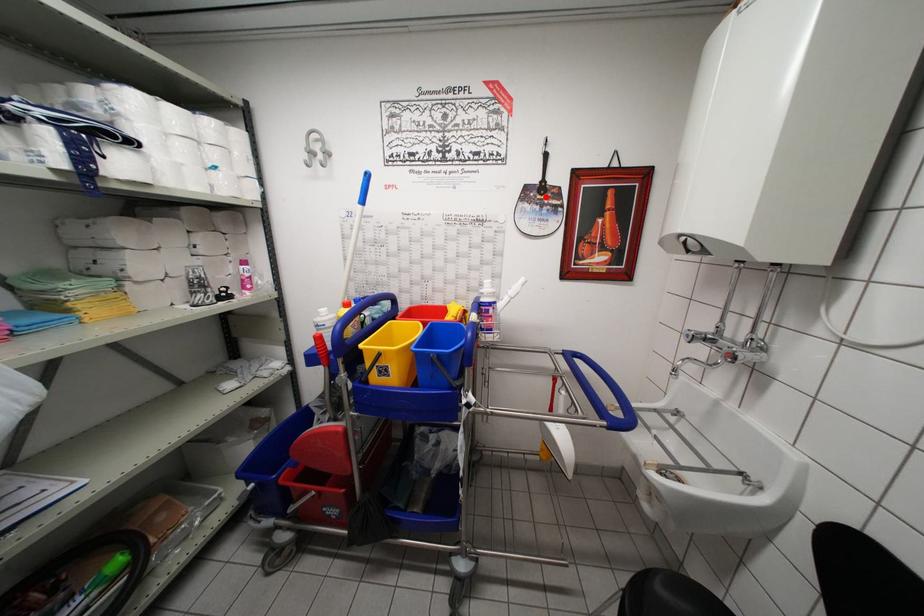
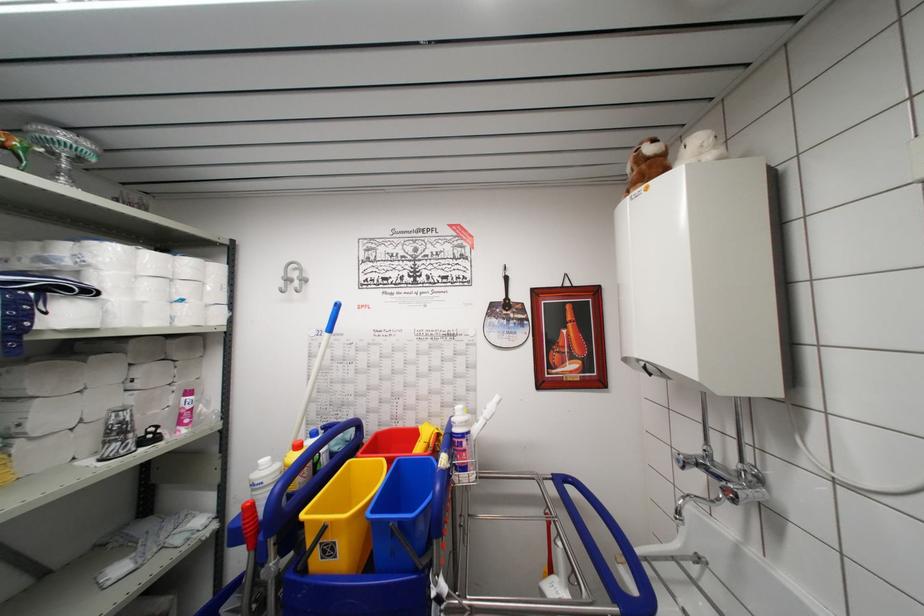
In the second image, find the point that corresponds to the highlighted location in the first image.

(511, 313)